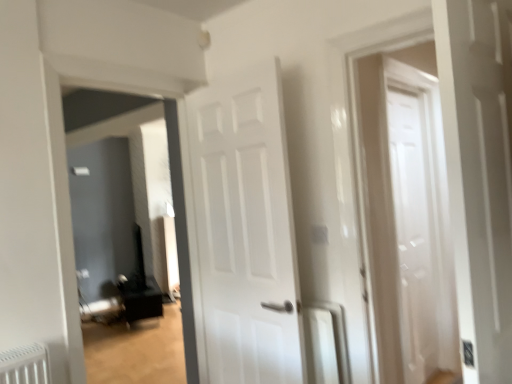
Question: Is white glossy radiator at center thinner than white glossy door at center?

Choices:
 (A) no
 (B) yes

Answer: (A)

Question: Considering the relative positions of white glossy radiator at center and white glossy door at center in the image provided, is white glossy radiator at center to the left of white glossy door at center from the viewer's perspective?

Choices:
 (A) yes
 (B) no

Answer: (B)

Question: From a real-world perspective, is white glossy radiator at center on white glossy door at center?

Choices:
 (A) yes
 (B) no

Answer: (B)

Question: Considering the relative positions of white glossy radiator at center and white glossy door at center in the image provided, is white glossy radiator at center behind white glossy door at center?

Choices:
 (A) no
 (B) yes

Answer: (B)

Question: Is white glossy radiator at center oriented towards white glossy door at center?

Choices:
 (A) no
 (B) yes

Answer: (B)

Question: Is white glossy radiator at center oriented away from white glossy door at center?

Choices:
 (A) yes
 (B) no

Answer: (B)

Question: Is white glossy door at center outside white glossy radiator at center?

Choices:
 (A) yes
 (B) no

Answer: (A)

Question: Is white glossy door at center further to the viewer compared to white glossy radiator at center?

Choices:
 (A) yes
 (B) no

Answer: (B)

Question: From the image's perspective, does white glossy door at center appear lower than white glossy radiator at center?

Choices:
 (A) yes
 (B) no

Answer: (B)

Question: From a real-world perspective, is white glossy door at center under white glossy radiator at center?

Choices:
 (A) no
 (B) yes

Answer: (A)

Question: From a real-world perspective, is white glossy door at center on top of white glossy radiator at center?

Choices:
 (A) no
 (B) yes

Answer: (B)

Question: Could you tell me if white glossy door at center is facing white glossy radiator at center?

Choices:
 (A) no
 (B) yes

Answer: (B)

Question: Is white glossy door at center inside matte black speaker at left?

Choices:
 (A) yes
 (B) no

Answer: (B)